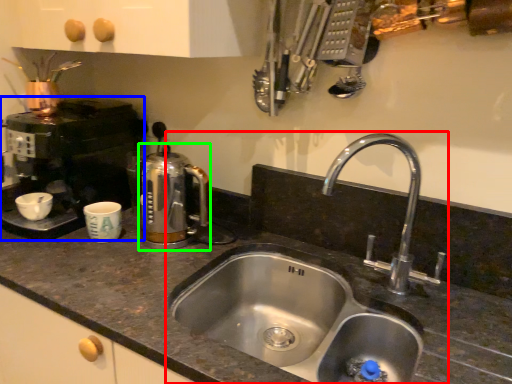
Question: Which object is positioned farthest from sink (highlighted by a red box)? Select from coffee machine (highlighted by a blue box) and coffeepot (highlighted by a green box).

Choices:
 (A) coffee machine
 (B) coffeepot

Answer: (A)